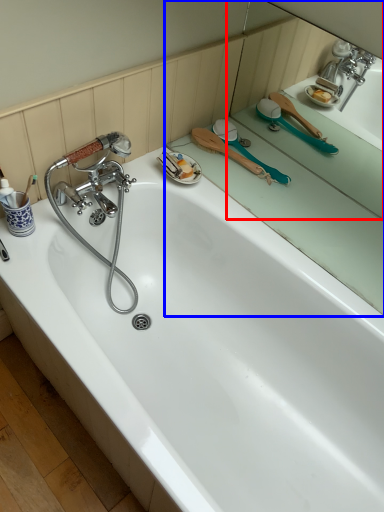
Question: Which object is further to the camera taking this photo, mirror (highlighted by a red box) or mirror (highlighted by a blue box)?

Choices:
 (A) mirror
 (B) mirror

Answer: (B)